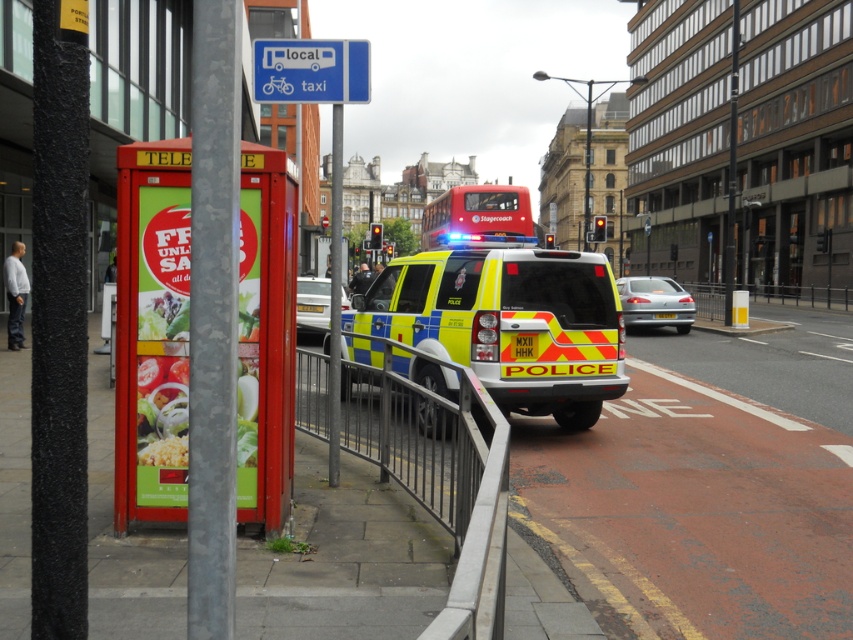
Who is positioned more to the right, yellow reflective plastic police vehicle at center or metallic pole at center?

yellow reflective plastic police vehicle at center

Consider the image. Is yellow reflective plastic police vehicle at center above metallic pole at center?

No.

Between point (590, 266) and point (329, 417), which one is positioned behind?

The point (590, 266) is behind.

You are a GUI agent. You are given a task and a screenshot of the screen. Output one action in this format:
    pyautogui.click(x=<x>, y=<y>)
    Task: Click on the yellow reflective plastic police vehicle at center
    The image size is (853, 640).
    Given the screenshot: What is the action you would take?
    pyautogui.click(x=503, y=308)

Does metallic gray railing at center have a greater height compared to silver metallic sedan at center?

Correct, metallic gray railing at center is much taller as silver metallic sedan at center.

Describe the element at coordinates (438, 470) in the screenshot. This screenshot has height=640, width=853. I see `metallic gray railing at center` at that location.

What do you see at coordinates (438, 470) in the screenshot? I see `metallic gray railing at center` at bounding box center [438, 470].

Find the location of `metallic gray railing at center`. metallic gray railing at center is located at coordinates (438, 470).

Who is lower down, yellow reflective plastic police vehicle at center or white glossy sedan at center?

Positioned lower is white glossy sedan at center.

Between yellow reflective plastic police vehicle at center and white glossy sedan at center, which one appears on the right side from the viewer's perspective?

Positioned to the right is yellow reflective plastic police vehicle at center.

Does point (558, 369) lie behind point (297, 332)?

No, it is in front of (297, 332).

You are a GUI agent. You are given a task and a screenshot of the screen. Output one action in this format:
    pyautogui.click(x=<x>, y=<y>)
    Task: Click on the yellow reflective plastic police vehicle at center
    
    Given the screenshot: What is the action you would take?
    pyautogui.click(x=503, y=308)